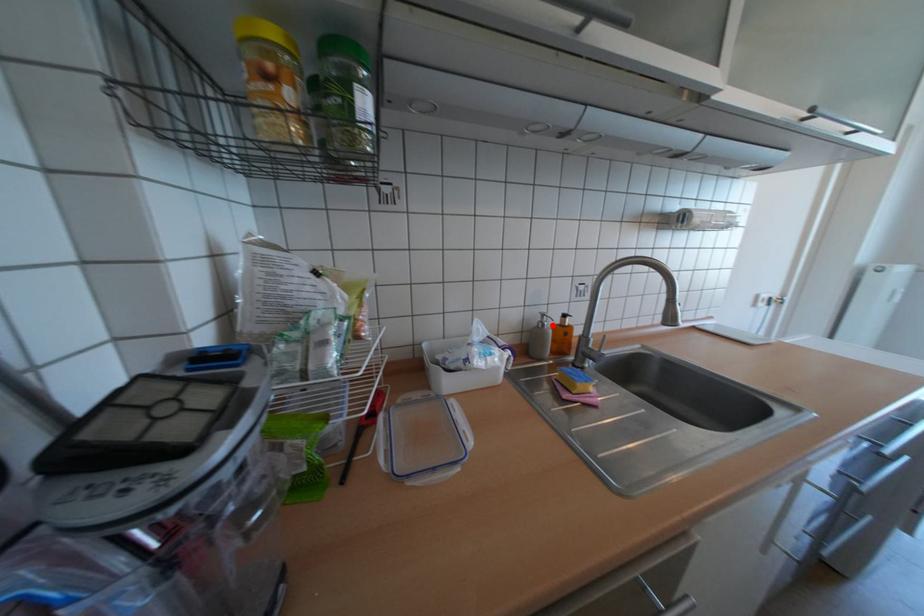
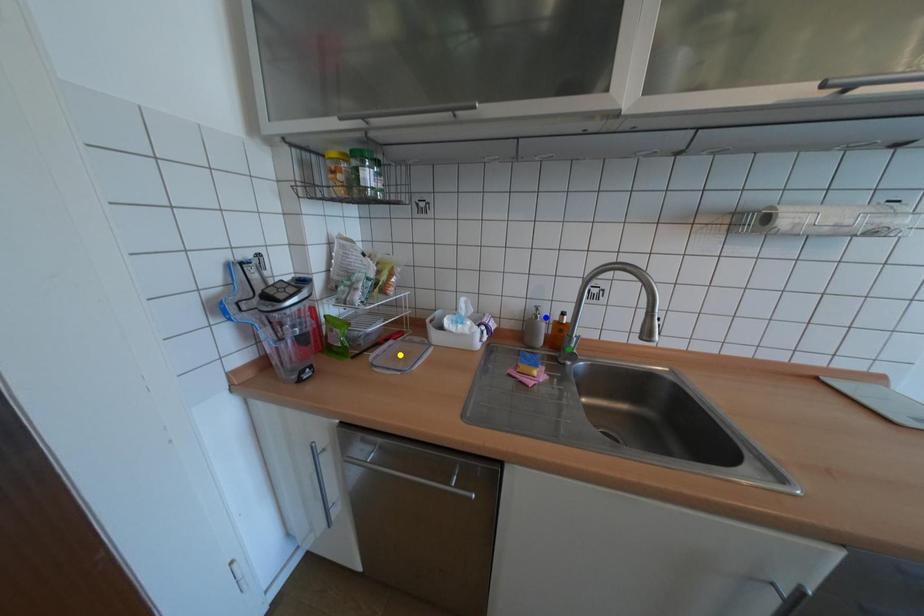
Question: I am providing you with two images of the same scene from different viewpoints. A red point is marked on the first image. You are given multiple points on the second image. Which mark in image 2 goes with the point in image 1?

Choices:
 (A) yellow point
 (B) green point
 (C) blue point

Answer: (C)